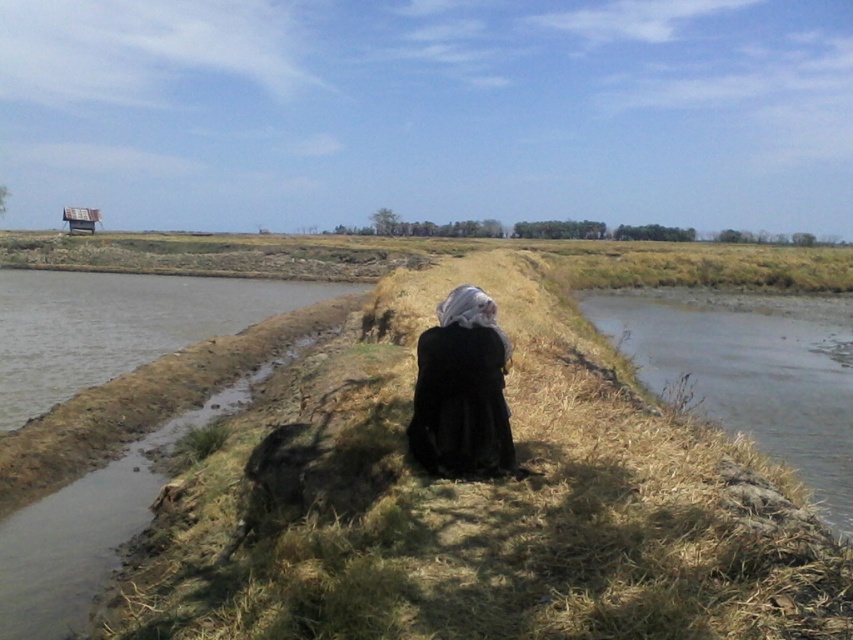
Is dry grass at center to the right of black matte dress at center from the viewer's perspective?

Yes, dry grass at center is to the right of black matte dress at center.

Does dry grass at center appear under black matte dress at center?

Actually, dry grass at center is above black matte dress at center.

Is point (137, 614) closer to viewer compared to point (503, 436)?

That is False.

Where is `dry grass at center`? This screenshot has height=640, width=853. dry grass at center is located at coordinates (491, 490).